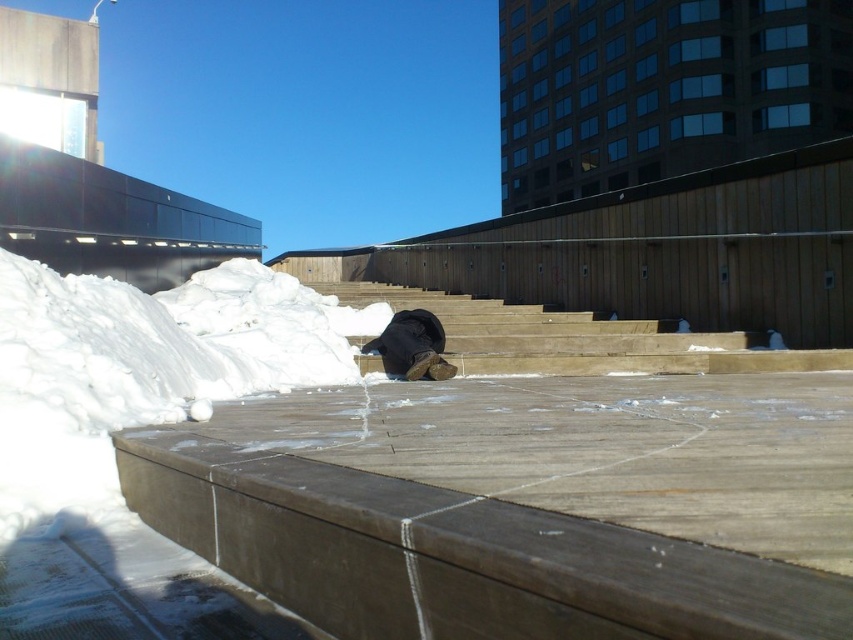
Looking at this image, you are standing at the point marked by the coordinates point (141,369) in the image. Looking around, you see the white fluffy snow at lower left. Which direction should you face to see the wooden steps leading upwards in the middle ground?

You should face towards the right because the wooden steps leading upwards in the middle ground are located to the right of the white fluffy snow at lower left.

You are standing at the bottom of the wooden steps in the middle ground. You see the wooden at center and the matte black hat at center. Which object is higher up from the ground?

The wooden at center is above the matte black hat at center, so the wooden at center is higher up from the ground.